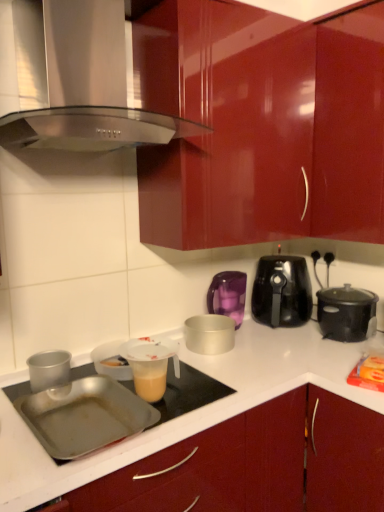
Question: Are matte silver container at center, which ranks as the third kitchen appliance in right-to-left order, and silver metallic pot at center, the 4th kitchen appliance positioned from the right, far apart?

Choices:
 (A) yes
 (B) no

Answer: (B)

Question: Could you tell me if matte silver container at center, which is counted as the third kitchen appliance, starting from the left, is turned towards silver metallic pot at center, acting as the second kitchen appliance starting from the left?

Choices:
 (A) yes
 (B) no

Answer: (B)

Question: Is silver metallic pot at center, acting as the second kitchen appliance starting from the left, completely or partially inside matte silver container at center, which is counted as the third kitchen appliance, starting from the left?

Choices:
 (A) yes
 (B) no

Answer: (B)

Question: Does matte silver container at center, which is counted as the third kitchen appliance, starting from the left, have a greater height compared to silver metallic pot at center, acting as the second kitchen appliance starting from the left?

Choices:
 (A) no
 (B) yes

Answer: (B)

Question: From the image's perspective, is matte silver container at center, which is counted as the third kitchen appliance, starting from the left, above silver metallic pot at center, acting as the second kitchen appliance starting from the left?

Choices:
 (A) no
 (B) yes

Answer: (B)

Question: Considering the relative positions of glossy wood cabinet at center and translucent plastic measuring cup at center in the image provided, is glossy wood cabinet at center to the left or to the right of translucent plastic measuring cup at center?

Choices:
 (A) left
 (B) right

Answer: (B)

Question: Is glossy wood cabinet at center spatially inside translucent plastic measuring cup at center, or outside of it?

Choices:
 (A) outside
 (B) inside

Answer: (A)

Question: Relative to translucent plastic measuring cup at center, is glossy wood cabinet at center in front or behind?

Choices:
 (A) behind
 (B) front

Answer: (B)

Question: Does point (375, 460) appear closer or farther from the camera than point (120, 351)?

Choices:
 (A) closer
 (B) farther

Answer: (A)

Question: Looking at their shapes, would you say glossy wood cabinet at center is wider or thinner than orange plastic bag at lower right?

Choices:
 (A) wide
 (B) thin

Answer: (A)

Question: Considering the relative positions of glossy wood cabinet at center and orange plastic bag at lower right in the image provided, is glossy wood cabinet at center to the left or to the right of orange plastic bag at lower right?

Choices:
 (A) right
 (B) left

Answer: (B)

Question: Which is correct: glossy wood cabinet at center is inside orange plastic bag at lower right, or outside of it?

Choices:
 (A) outside
 (B) inside

Answer: (A)

Question: Is glossy wood cabinet at center taller or shorter than orange plastic bag at lower right?

Choices:
 (A) tall
 (B) short

Answer: (A)

Question: In terms of height, does black plastic air fryer at center right, which is the 4th kitchen appliance in left-to-right order, look taller or shorter compared to black plastic slow cooker at right, placed as the first kitchen appliance when sorted from right to left?

Choices:
 (A) tall
 (B) short

Answer: (A)

Question: Do you think black plastic air fryer at center right, which is the 4th kitchen appliance in left-to-right order, is within black plastic slow cooker at right, placed as the first kitchen appliance when sorted from right to left, or outside of it?

Choices:
 (A) outside
 (B) inside

Answer: (A)